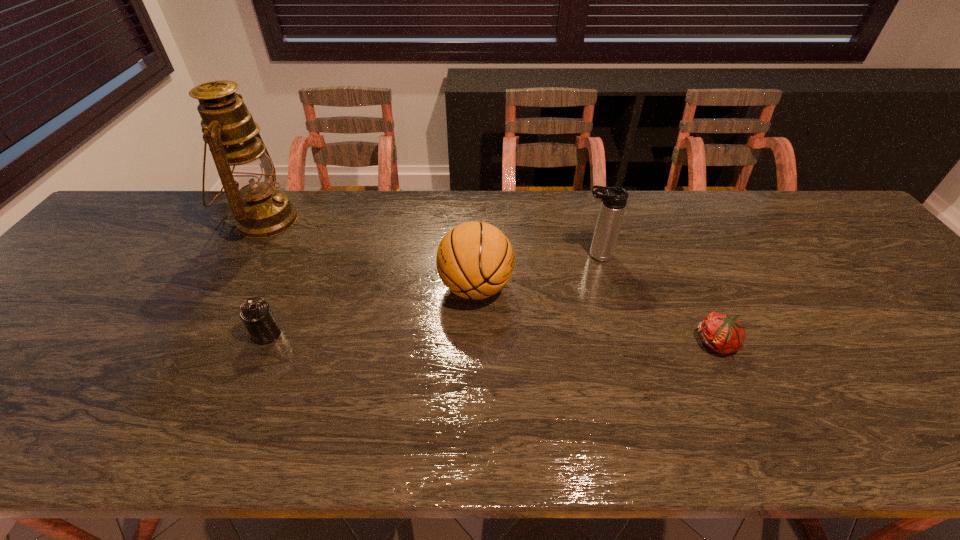
You are a GUI agent. You are given a task and a screenshot of the screen. Output one action in this format:
    pyautogui.click(x=<x>, y=<y>)
    Task: Click on the free space located on the handle side of the second object from right to left
    This screenshot has width=960, height=540.
    Given the screenshot: What is the action you would take?
    tap(459, 255)

You are a GUI agent. You are given a task and a screenshot of the screen. Output one action in this format:
    pyautogui.click(x=<x>, y=<y>)
    Task: Click on the vacant space located 0.070m on the handle side of the second object from right to left
    This screenshot has height=540, width=960.
    Given the screenshot: What is the action you would take?
    pyautogui.click(x=553, y=255)

Locate an element on the screen. The width and height of the screenshot is (960, 540). free region located 0.310m on the surface of the basketball near the brand logo is located at coordinates (633, 287).

The width and height of the screenshot is (960, 540). What are the coordinates of `free space located 0.320m on the back of the second object from left to right` in the screenshot? It's located at (308, 237).

This screenshot has width=960, height=540. Identify the location of vacant space situated on the back of the shortest object. (660, 221).

The width and height of the screenshot is (960, 540). I want to click on object at the far edge, so click(x=247, y=173).

This screenshot has height=540, width=960. What are the coordinates of `vacant space at the far edge` in the screenshot? It's located at (538, 190).

In order to click on blank space at the near edge of the desktop in this screenshot , I will do `click(792, 436)`.

This screenshot has height=540, width=960. Identify the location of free spot at the left edge of the desktop. (68, 274).

In the image, there is a desktop. Where is `vacant region at the right edge`? vacant region at the right edge is located at coordinates (893, 330).